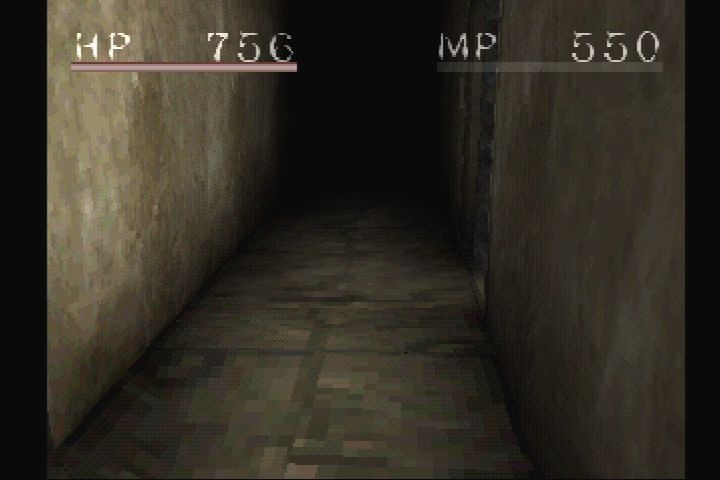
The height and width of the screenshot is (480, 720). What are the coordinates of `empty space in hallway` in the screenshot? It's located at (342, 307).